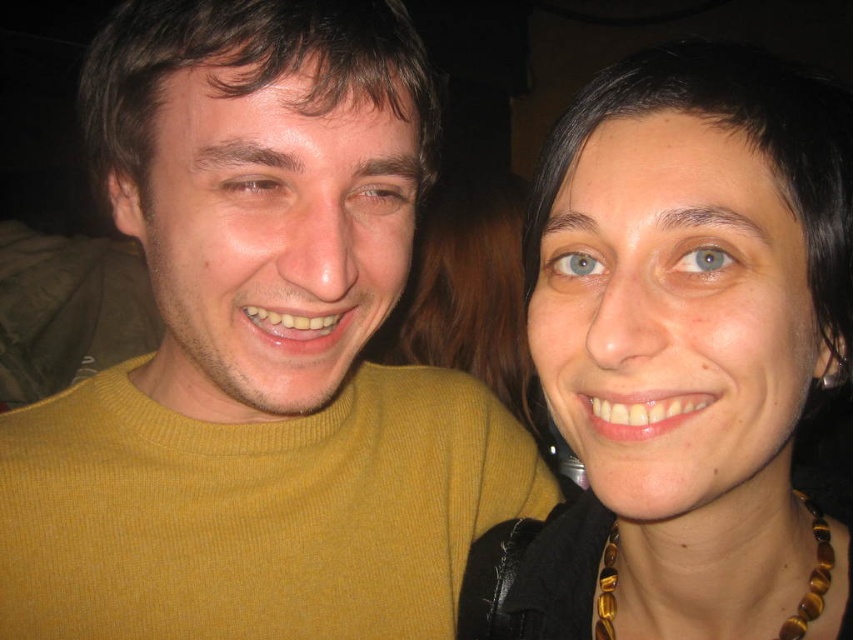
Question: Can you confirm if brown matte eye at upper center is positioned to the right of blue glossy eye at upper center?

Choices:
 (A) yes
 (B) no

Answer: (B)

Question: Does brown beaded necklace at upper right have a larger size compared to brown matte eye at upper left?

Choices:
 (A) no
 (B) yes

Answer: (B)

Question: Which point is closer to the camera taking this photo?

Choices:
 (A) (622, 540)
 (B) (695, 262)
 (C) (251, 179)
 (D) (358, 211)

Answer: (B)

Question: Is brown beaded necklace at upper right positioned in front of brown matte eye at upper center?

Choices:
 (A) no
 (B) yes

Answer: (B)

Question: Which object is farther from the camera taking this photo?

Choices:
 (A) blue glossy eye at upper center
 (B) brown beaded necklace at upper right
 (C) blue matte eye at upper center
 (D) yellow ribbed sweater at left

Answer: (C)

Question: Which point is farther to the camera?

Choices:
 (A) (410, 193)
 (B) (186, 65)
 (C) (664, 408)

Answer: (A)